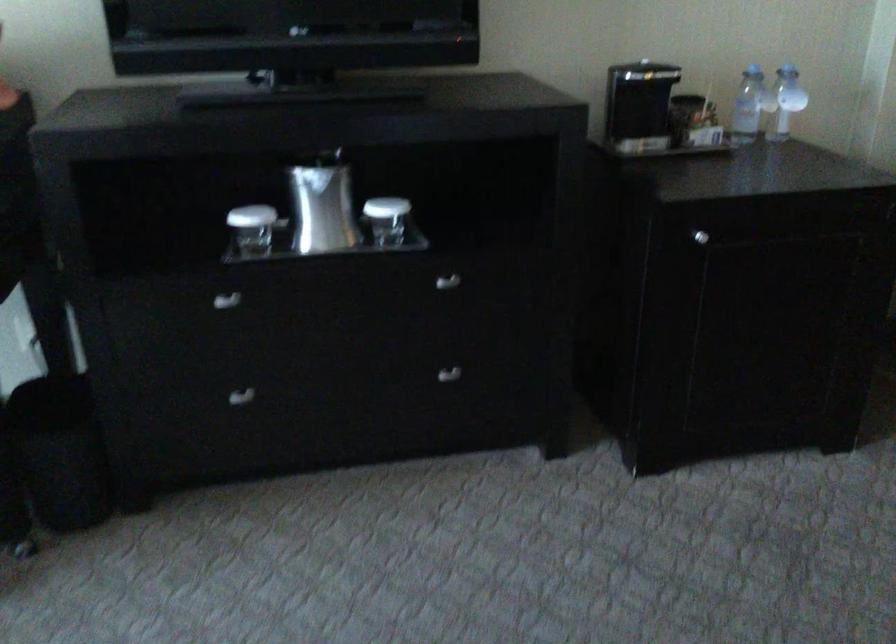
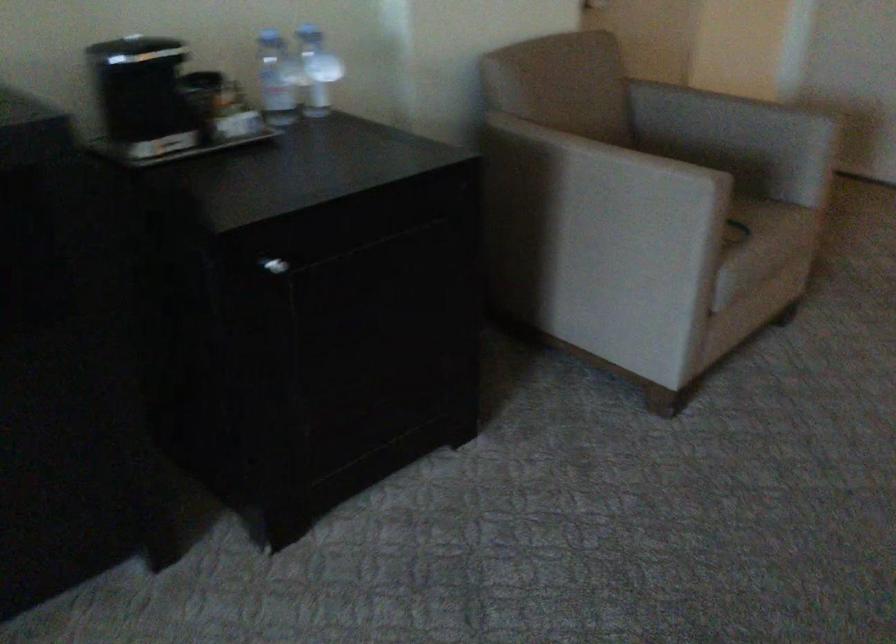
Question: The first image is from the beginning of the video and the second image is from the end. How did the camera likely rotate when shooting the video?

Choices:
 (A) Left
 (B) Right
 (C) Up
 (D) Down

Answer: (B)